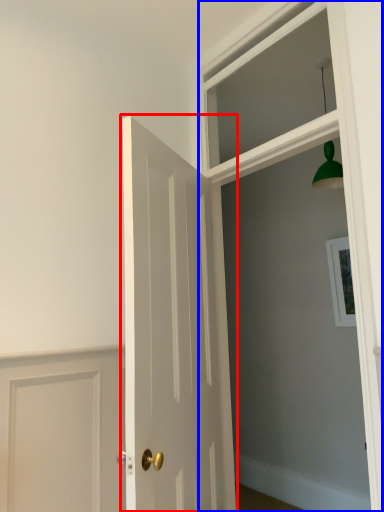
Question: Which point is closer to the camera, door (highlighted by a red box) or window frame (highlighted by a blue box)?

Choices:
 (A) door
 (B) window frame

Answer: (A)